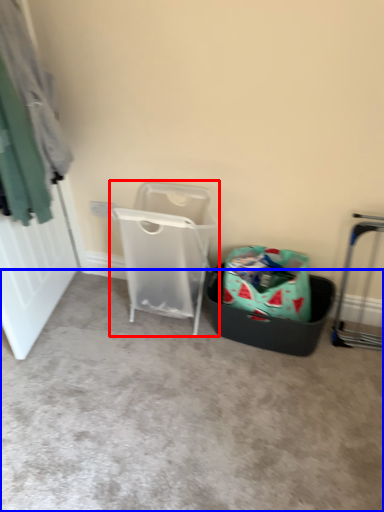
Question: Which point is closer to the camera, waste container (highlighted by a red box) or concrete (highlighted by a blue box)?

Choices:
 (A) waste container
 (B) concrete

Answer: (B)